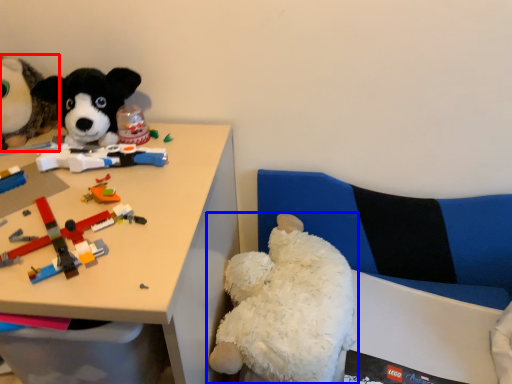
Question: Which point is closer to the camera, toy (highlighted by a red box) or toy (highlighted by a blue box)?

Choices:
 (A) toy
 (B) toy

Answer: (B)